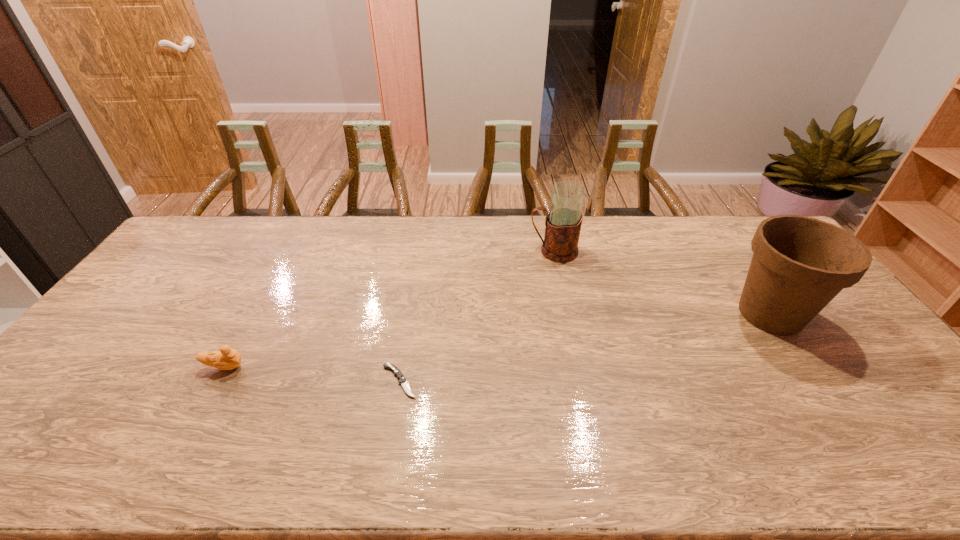
Find the location of `vacant space at the far left corner`. vacant space at the far left corner is located at coordinates (226, 228).

At what (x,y) coordinates should I click in order to perform the action: click on vacant space at the near right corner of the desktop. Please return your answer as a coordinate pair (x, y). Looking at the image, I should click on (899, 457).

Identify the location of blank region between the third tallest object and the pocketknife. (312, 374).

Where is `vacant space that's between the duckling and the third nearest object`? vacant space that's between the duckling and the third nearest object is located at coordinates (497, 340).

At what (x,y) coordinates should I click in order to perform the action: click on empty location between the rightmost object and the duckling. Please return your answer as a coordinate pair (x, y). This screenshot has height=540, width=960. Looking at the image, I should click on (497, 340).

This screenshot has width=960, height=540. I want to click on vacant area that lies between the farthest object and the second shortest object, so click(389, 309).

Identify the location of vacant point located between the rightmost object and the third object from left to right. (661, 282).

Identify the location of vacant area that lies between the second object from right to left and the flowerpot. The height and width of the screenshot is (540, 960). (661, 282).

Locate an element on the screen. This screenshot has width=960, height=540. vacant area that lies between the duckling and the second farthest object is located at coordinates (497, 340).

This screenshot has height=540, width=960. In order to click on free spot between the farthest object and the third nearest object in this screenshot , I will do `click(661, 282)`.